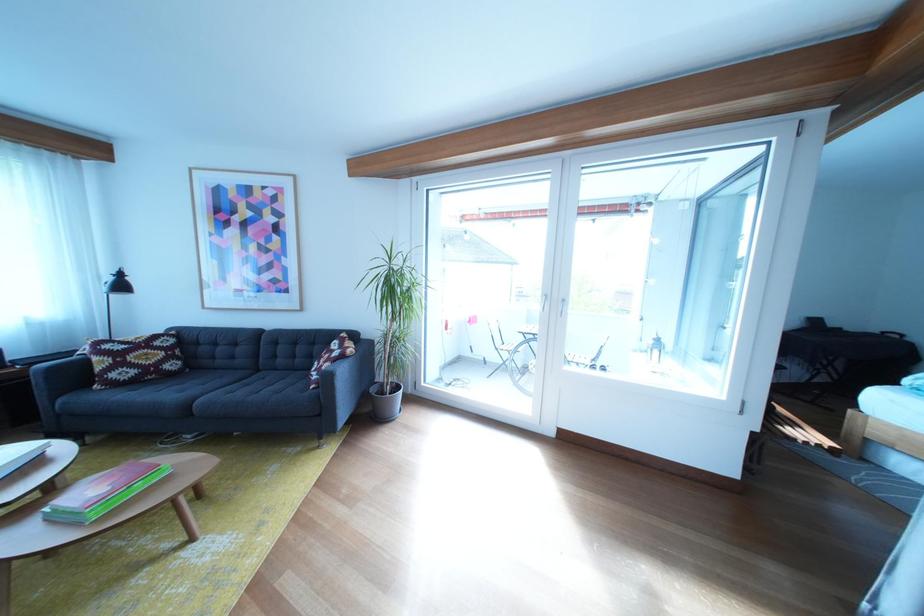
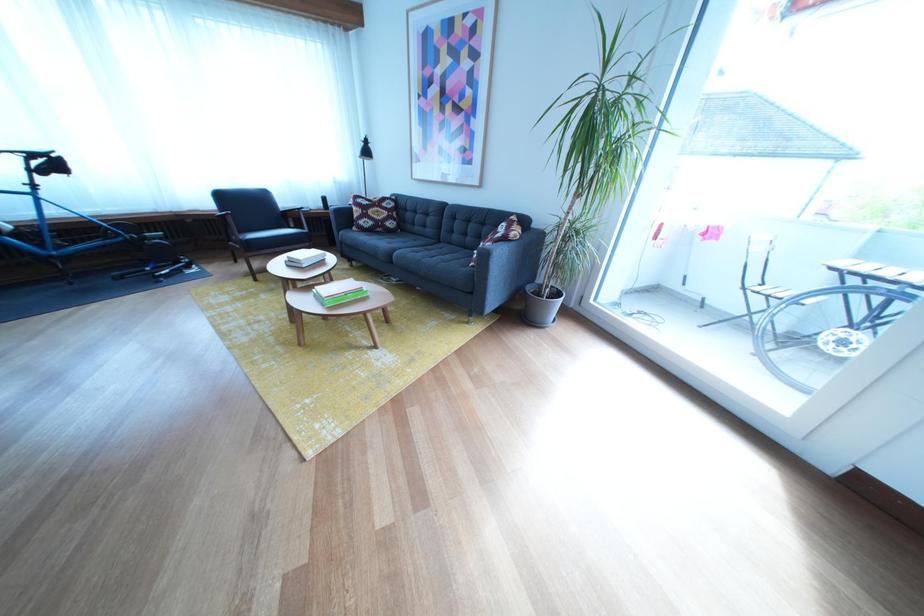
In the second image, find the point that corresponds to pixel 310 367 in the first image.

(481, 245)